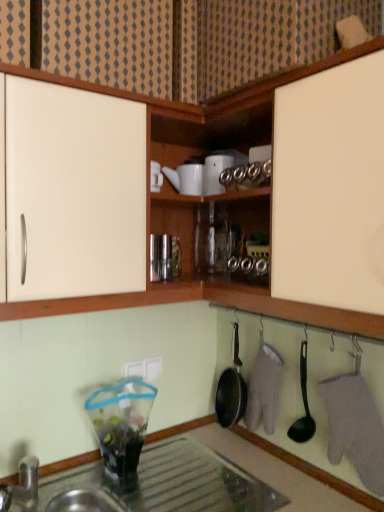
Question: Is white glossy teapot at upper center, the 4th appliance ordered from the bottom, bigger than black plastic spoon at lower center?

Choices:
 (A) yes
 (B) no

Answer: (B)

Question: Is white glossy teapot at upper center, the 4th appliance ordered from the bottom, far away from black plastic spoon at lower center?

Choices:
 (A) yes
 (B) no

Answer: (B)

Question: Is the position of white glossy teapot at upper center, which ranks as the first appliance in top-to-bottom order, less distant than that of black plastic spoon at lower center?

Choices:
 (A) yes
 (B) no

Answer: (B)

Question: Is black plastic spoon at lower center located within white glossy teapot at upper center, which ranks as the first appliance in top-to-bottom order?

Choices:
 (A) no
 (B) yes

Answer: (A)

Question: From the image's perspective, would you say white glossy teapot at upper center, the 4th appliance ordered from the bottom, is positioned over black plastic spoon at lower center?

Choices:
 (A) yes
 (B) no

Answer: (A)

Question: Can you confirm if white glossy teapot at upper center, which ranks as the first appliance in top-to-bottom order, is smaller than black plastic spoon at lower center?

Choices:
 (A) no
 (B) yes

Answer: (B)

Question: Could you tell me if white glossy teapot at upper center, the 4th appliance ordered from the bottom, is facing transparent glass countertop at lower left?

Choices:
 (A) no
 (B) yes

Answer: (A)

Question: Are white glossy teapot at upper center, the 4th appliance ordered from the bottom, and transparent glass countertop at lower left located far from each other?

Choices:
 (A) yes
 (B) no

Answer: (B)

Question: Does white glossy teapot at upper center, the 4th appliance ordered from the bottom, have a larger size compared to transparent glass countertop at lower left?

Choices:
 (A) no
 (B) yes

Answer: (A)

Question: Is transparent glass countertop at lower left at the back of white glossy teapot at upper center, which ranks as the first appliance in top-to-bottom order?

Choices:
 (A) no
 (B) yes

Answer: (A)

Question: From the image's perspective, is white glossy teapot at upper center, the 4th appliance ordered from the bottom, under transparent glass countertop at lower left?

Choices:
 (A) yes
 (B) no

Answer: (B)

Question: Would you say white glossy teapot at upper center, which ranks as the first appliance in top-to-bottom order, contains transparent glass countertop at lower left?

Choices:
 (A) no
 (B) yes

Answer: (A)

Question: Is white glossy teapot at upper center, which ranks as the first appliance in top-to-bottom order, located outside white plastic electric outlet at lower center?

Choices:
 (A) yes
 (B) no

Answer: (A)